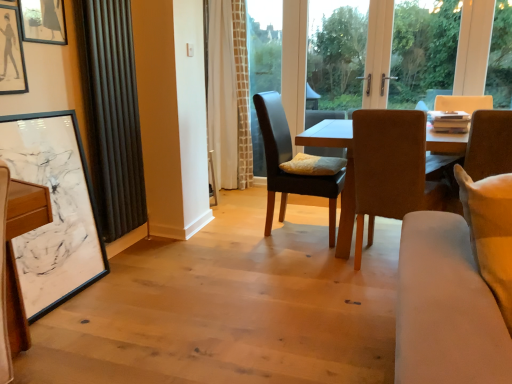
Find the location of a particular element. The height and width of the screenshot is (384, 512). black matte picture frame at upper left, marked as the 2th picture frame in a bottom-to-top arrangement is located at coordinates (11, 53).

What do you see at coordinates (229, 95) in the screenshot?
I see `white textured curtain at center, which is counted as the first curtain, starting from the back` at bounding box center [229, 95].

Image resolution: width=512 pixels, height=384 pixels. What do you see at coordinates (288, 160) in the screenshot?
I see `leather cushioned chair at center, which appears as the third chair when viewed from the right` at bounding box center [288, 160].

Identify the location of black ribbed curtain at left, which appears as the 1th curtain when viewed from the left. (112, 113).

Which object is further away from the camera, white textured curtain at center, which is counted as the first curtain, starting from the back, or leather cushioned chair at center, which appears as the third chair when viewed from the right?

Positioned behind is white textured curtain at center, which is counted as the first curtain, starting from the back.

Which point is more distant from viewer, (234, 88) or (335, 186)?

The point (234, 88) is farther from the camera.

Between white textured curtain at center, the first curtain positioned from the right, and leather cushioned chair at center, the 1th chair in the left-to-right sequence, which one has smaller size?

leather cushioned chair at center, the 1th chair in the left-to-right sequence.

Is white textured curtain at center, which is counted as the first curtain, starting from the back, taller or shorter than leather cushioned chair at center, which appears as the third chair when viewed from the right?

white textured curtain at center, which is counted as the first curtain, starting from the back, is taller than leather cushioned chair at center, which appears as the third chair when viewed from the right.

Based on the photo, from a real-world perspective, is black matte picture frame at upper left, marked as the 2th picture frame in a bottom-to-top arrangement, positioned over brown leather chair at right, the third chair viewed from the left, based on gravity?

Yes, from a real-world perspective, black matte picture frame at upper left, marked as the 2th picture frame in a bottom-to-top arrangement, is above brown leather chair at right, the third chair viewed from the left.

Which is more to the right, black matte picture frame at upper left, placed as the 2th picture frame when sorted from top to bottom, or brown leather chair at right, the 1th chair viewed from the right?

brown leather chair at right, the 1th chair viewed from the right.

Considering the sizes of objects black matte picture frame at upper left, marked as the 2th picture frame in a bottom-to-top arrangement, and brown leather chair at right, the third chair viewed from the left, in the image provided, who is taller, black matte picture frame at upper left, marked as the 2th picture frame in a bottom-to-top arrangement, or brown leather chair at right, the third chair viewed from the left,?

Standing taller between the two is brown leather chair at right, the third chair viewed from the left.

Based on the photo, are black matte picture frame at upper left, placed as the 2th picture frame when sorted from top to bottom, and brown leather chair at right, the 1th chair viewed from the right, making contact?

No, black matte picture frame at upper left, placed as the 2th picture frame when sorted from top to bottom, is not in contact with brown leather chair at right, the 1th chair viewed from the right.

Measure the distance from white matte picture frame at left, placed as the third picture frame when sorted from top to bottom, to brown leather chair at right, the third chair viewed from the left.

white matte picture frame at left, placed as the third picture frame when sorted from top to bottom, and brown leather chair at right, the third chair viewed from the left, are 7.10 feet apart.

Is white matte picture frame at left, which is the 1th picture frame in bottom-to-top order, directly adjacent to brown leather chair at right, the third chair viewed from the left?

No.

How many degrees apart are the facing directions of white matte picture frame at left, which is the 1th picture frame in bottom-to-top order, and brown leather chair at right, the 1th chair viewed from the right?

90 degrees.

From the image's perspective, does white matte picture frame at left, which is the 1th picture frame in bottom-to-top order, appear higher than brown leather chair at right, the third chair viewed from the left?

No.

Is there a large distance between brown leather chair at right, the 1th chair viewed from the right, and soft yellow pillow at center?

brown leather chair at right, the 1th chair viewed from the right, is near soft yellow pillow at center, not far away.

In the image, is brown leather chair at right, the 1th chair viewed from the right, positioned in front of or behind soft yellow pillow at center?

brown leather chair at right, the 1th chair viewed from the right, is positioned closer to the viewer than soft yellow pillow at center.

Is brown leather chair at right, the third chair viewed from the left, at the right side of soft yellow pillow at center?

Yes, brown leather chair at right, the third chair viewed from the left, is to the right of soft yellow pillow at center.

Is point (507, 114) closer to viewer compared to point (318, 162)?

Yes, point (507, 114) is in front of point (318, 162).

In the scene shown: Is the surface of black matte picture frame at upper left, placed as the 2th picture frame when sorted from top to bottom, in direct contact with black ribbed curtain at left, arranged as the second curtain when viewed from the back?

No, black matte picture frame at upper left, placed as the 2th picture frame when sorted from top to bottom, is not touching black ribbed curtain at left, arranged as the second curtain when viewed from the back.

From the image's perspective, which object appears higher, black matte picture frame at upper left, marked as the 2th picture frame in a bottom-to-top arrangement, or black ribbed curtain at left, arranged as the 1th curtain when viewed from the front?

black matte picture frame at upper left, marked as the 2th picture frame in a bottom-to-top arrangement.

Is black matte picture frame at upper left, marked as the 2th picture frame in a bottom-to-top arrangement, positioned with its back to black ribbed curtain at left, arranged as the 1th curtain when viewed from the front?

No.

Who is more distant, soft yellow pillow at center or matte black picture frame at upper left, marked as the first picture frame in a top-to-bottom arrangement?

soft yellow pillow at center.

Would you say soft yellow pillow at center is outside matte black picture frame at upper left, marked as the first picture frame in a top-to-bottom arrangement?

Yes, soft yellow pillow at center is located beyond the bounds of matte black picture frame at upper left, marked as the first picture frame in a top-to-bottom arrangement.

Does soft yellow pillow at center have a lesser width compared to matte black picture frame at upper left, marked as the first picture frame in a top-to-bottom arrangement?

No.

Where is `the 1st picture frame in front of the soft yellow pillow at center, starting your count from the anchor`? The image size is (512, 384). the 1st picture frame in front of the soft yellow pillow at center, starting your count from the anchor is located at coordinates (42, 21).

Is point (226, 166) positioned before point (41, 15)?

No, it is behind (41, 15).

Considering the relative positions of white textured curtain at center, the first curtain positioned from the right, and matte black picture frame at upper left, the third picture frame ordered from the bottom, in the image provided, is white textured curtain at center, the first curtain positioned from the right, in front of matte black picture frame at upper left, the third picture frame ordered from the bottom,?

No.

Which is more to the right, white textured curtain at center, the 2th curtain when ordered from left to right, or matte black picture frame at upper left, marked as the first picture frame in a top-to-bottom arrangement?

From the viewer's perspective, white textured curtain at center, the 2th curtain when ordered from left to right, appears more on the right side.

Which object is wider, white textured curtain at center, which is counted as the second curtain, starting from the front, or matte black picture frame at upper left, the third picture frame ordered from the bottom?

With larger width is white textured curtain at center, which is counted as the second curtain, starting from the front.

From a real-world perspective, starting from the white textured curtain at center, the first curtain positioned from the right, which chair is the 2nd one below it? Please provide its 2D coordinates.

[(288, 160)]

I want to click on chair that is the 3rd object to the right of the black matte picture frame at upper left, placed as the 2th picture frame when sorted from top to bottom, starting at the anchor, so click(x=489, y=144).

Looking at the image, which one is located further to suede brown chair at center, acting as the second chair starting from the right, light beige fabric couch at lower right or matte black picture frame at upper left, marked as the first picture frame in a top-to-bottom arrangement?

Based on the image, matte black picture frame at upper left, marked as the first picture frame in a top-to-bottom arrangement, appears to be further to suede brown chair at center, acting as the second chair starting from the right.

Based on their spatial positions, is white matte picture frame at left, which is the 1th picture frame in bottom-to-top order, or white textured curtain at center, the 2th curtain when ordered from left to right, further from suede brown chair at center, which is the second chair in left-to-right order?

white textured curtain at center, the 2th curtain when ordered from left to right, is positioned further to the anchor suede brown chair at center, which is the second chair in left-to-right order.

Based on the photo, when comparing their distances from soft yellow pillow at center, does matte black picture frame at upper left, the third picture frame ordered from the bottom, or suede brown chair at center, acting as the second chair starting from the right, seem closer?

suede brown chair at center, acting as the second chair starting from the right, lies closer to soft yellow pillow at center than the other object.

Looking at the image, which one is located further to light beige fabric couch at lower right, leather cushioned chair at center, which appears as the third chair when viewed from the right, or brown leather chair at right, the 1th chair viewed from the right?

The object further to light beige fabric couch at lower right is leather cushioned chair at center, which appears as the third chair when viewed from the right.

Looking at the image, which one is located further to white textured curtain at center, the first curtain positioned from the right, black ribbed curtain at left, arranged as the 1th curtain when viewed from the front, or brown leather chair at right, the third chair viewed from the left?

Based on the image, brown leather chair at right, the third chair viewed from the left, appears to be further to white textured curtain at center, the first curtain positioned from the right.

Looking at the image, which one is located further to light beige fabric couch at lower right, matte black picture frame at upper left, the third picture frame ordered from the bottom, or leather cushioned chair at center, the 1th chair in the left-to-right sequence?

matte black picture frame at upper left, the third picture frame ordered from the bottom, is positioned further to the anchor light beige fabric couch at lower right.

When comparing their distances from light beige fabric couch at lower right, does matte black picture frame at upper left, marked as the first picture frame in a top-to-bottom arrangement, or soft yellow pillow at center seem further?

matte black picture frame at upper left, marked as the first picture frame in a top-to-bottom arrangement.

When comparing their distances from leather cushioned chair at center, which appears as the third chair when viewed from the right, does soft yellow pillow at center or matte black picture frame at upper left, the third picture frame ordered from the bottom, seem further?

Based on the image, matte black picture frame at upper left, the third picture frame ordered from the bottom, appears to be further to leather cushioned chair at center, which appears as the third chair when viewed from the right.

Where is `chair between suede brown chair at center, which is the second chair in left-to-right order, and soft yellow pillow at center, along the z-axis`? chair between suede brown chair at center, which is the second chair in left-to-right order, and soft yellow pillow at center, along the z-axis is located at coordinates click(288, 160).

Where is `curtain located between leather cushioned chair at center, which appears as the third chair when viewed from the right, and orange textured curtain at center in the depth direction`? curtain located between leather cushioned chair at center, which appears as the third chair when viewed from the right, and orange textured curtain at center in the depth direction is located at coordinates (229, 95).

You are a GUI agent. You are given a task and a screenshot of the screen. Output one action in this format:
    pyautogui.click(x=<x>, y=<y>)
    Task: Click on the pillow between black matte picture frame at upper left, placed as the 2th picture frame when sorted from top to bottom, and orange textured curtain at center from front to back
    The height and width of the screenshot is (384, 512).
    Given the screenshot: What is the action you would take?
    pyautogui.click(x=313, y=165)

Locate an element on the screen. This screenshot has height=384, width=512. curtain between black matte picture frame at upper left, marked as the 2th picture frame in a bottom-to-top arrangement, and white textured curtain at center, the first curtain positioned from the right, in the front-back direction is located at coordinates point(112,113).